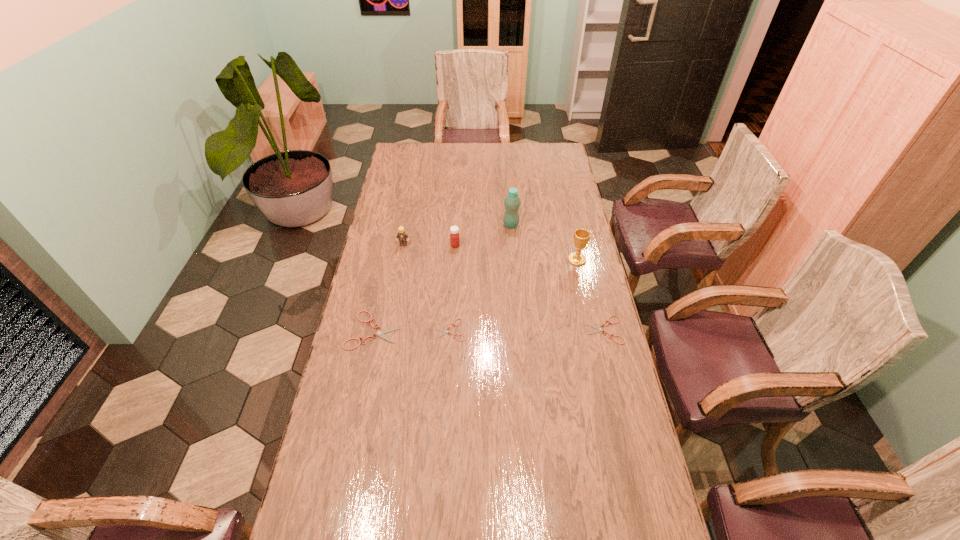
Where is `vacant region between the sixth shortest object and the Lego`? This screenshot has height=540, width=960. vacant region between the sixth shortest object and the Lego is located at coordinates (491, 252).

Where is `free space between the chalice and the tallest shears`? This screenshot has width=960, height=540. free space between the chalice and the tallest shears is located at coordinates (475, 295).

This screenshot has height=540, width=960. I want to click on vacant area that lies between the tallest shears and the medicine, so [415, 288].

The image size is (960, 540). Identify the location of free spot between the leftmost shears and the Lego. (389, 287).

You are a GUI agent. You are given a task and a screenshot of the screen. Output one action in this format:
    pyautogui.click(x=<x>, y=<y>)
    Task: Click on the free spot between the tallest shears and the fourth farthest object
    Image resolution: width=960 pixels, height=540 pixels.
    Given the screenshot: What is the action you would take?
    pyautogui.click(x=475, y=295)

The height and width of the screenshot is (540, 960). Identify the location of vacant region between the third shortest object and the tallest object. 443,278.

What are the coordinates of `free space that is in between the tallest shears and the fourth farthest object` in the screenshot? It's located at (475, 295).

Locate an element on the screen. This screenshot has width=960, height=540. object that is the fourth closest to the shortest object is located at coordinates (599, 329).

Locate an element on the screen. This screenshot has height=540, width=960. object identified as the closest to the shortest shears is located at coordinates (381, 333).

Locate an element on the screen. This screenshot has width=960, height=540. shears that is the closest one to the second shortest object is located at coordinates (445, 331).